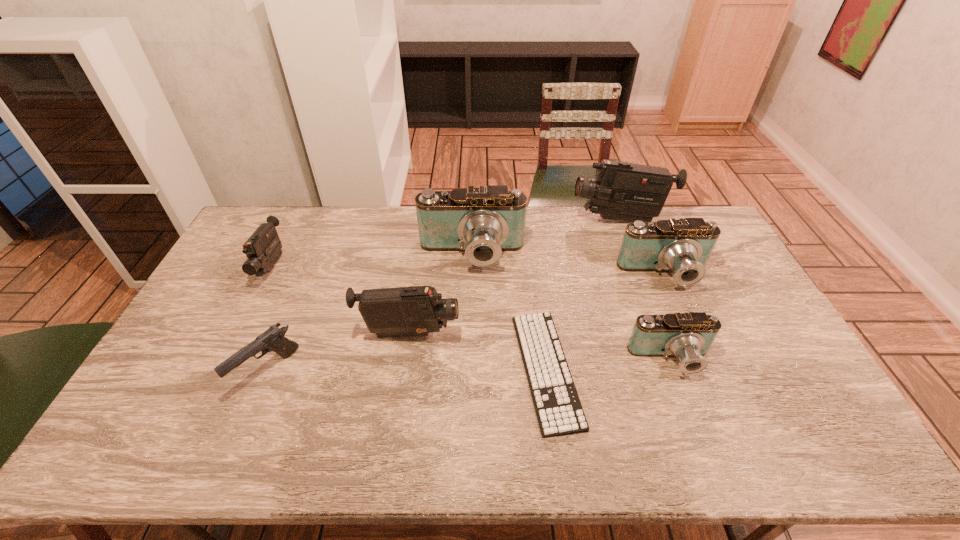
Identify the location of the second object from left to right. The width and height of the screenshot is (960, 540). (273, 339).

Identify the location of computer keyboard. The height and width of the screenshot is (540, 960). (559, 412).

I want to click on free location located 0.090m on the front-facing side of the farthest camcorder, so click(547, 220).

What are the coordinates of `vacant space located 0.310m on the front-facing side of the farthest camcorder` in the screenshot? It's located at (491, 220).

You are a GUI agent. You are given a task and a screenshot of the screen. Output one action in this format:
    pyautogui.click(x=<x>, y=<y>)
    Task: Click on the free space located 0.200m on the front-facing side of the farthest camcorder
    Image resolution: width=960 pixels, height=540 pixels.
    Given the screenshot: What is the action you would take?
    pyautogui.click(x=519, y=220)

Image resolution: width=960 pixels, height=540 pixels. Find the location of `free location located on the front-facing side of the leftmost blue camcorder`. free location located on the front-facing side of the leftmost blue camcorder is located at coordinates (470, 310).

Where is `vacant space located on the front-facing side of the second smallest black camcorder`? The height and width of the screenshot is (540, 960). vacant space located on the front-facing side of the second smallest black camcorder is located at coordinates (507, 334).

Identify the location of vacant space situated on the front-facing side of the second biggest blue camcorder. (680, 310).

Locate an element on the screen. vacant space located on the front-facing side of the second farthest black camcorder is located at coordinates (207, 393).

This screenshot has height=540, width=960. I want to click on free space located 0.050m on the front-facing side of the smallest blue camcorder, so click(684, 397).